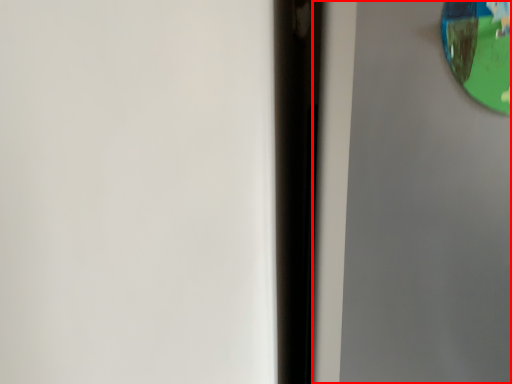
Question: From the image's perspective, what is the correct spatial relationship of screen door (annotated by the red box) in relation to view mirror?

Choices:
 (A) above
 (B) below

Answer: (B)